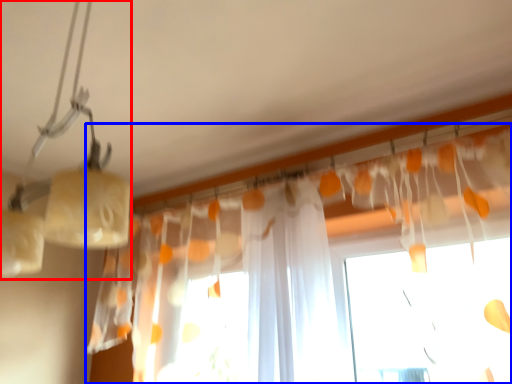
Question: Which object is closer to the camera taking this photo, lamp (highlighted by a red box) or curtain (highlighted by a blue box)?

Choices:
 (A) lamp
 (B) curtain

Answer: (A)